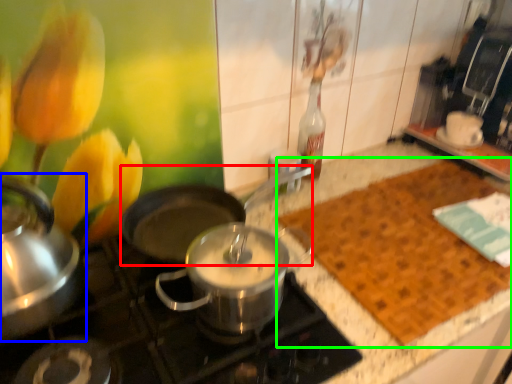
Question: Which is nearer to the wok (highlighted by a red box)? kitchen appliance (highlighted by a blue box) or mat (highlighted by a green box).

Choices:
 (A) kitchen appliance
 (B) mat

Answer: (A)